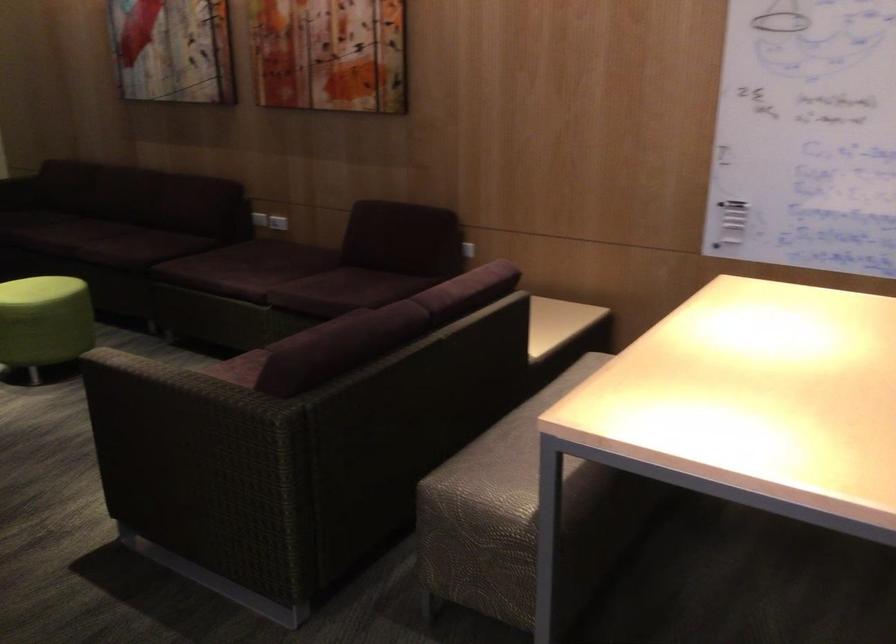
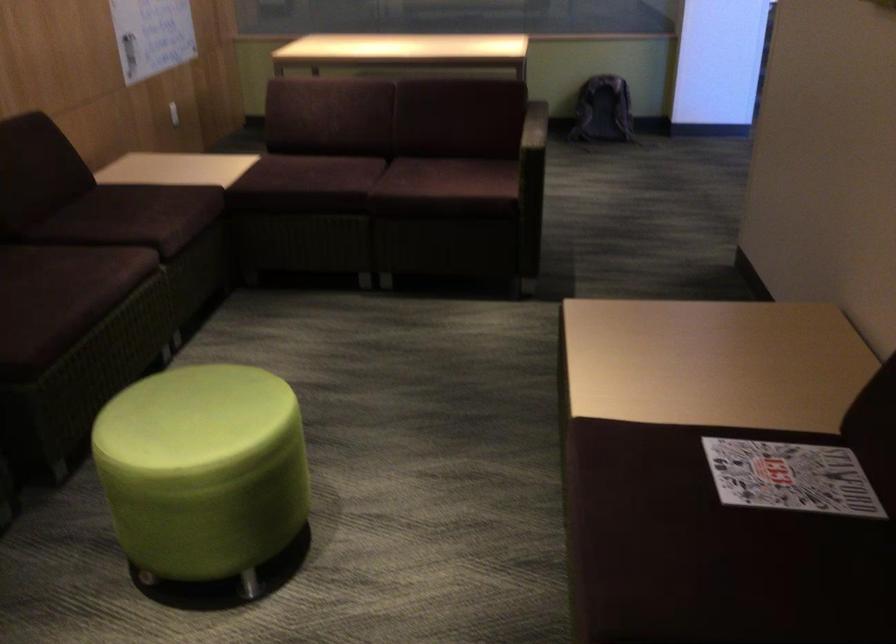
In the second image, find the point that corresponds to pixel 321 283 in the first image.

(147, 214)